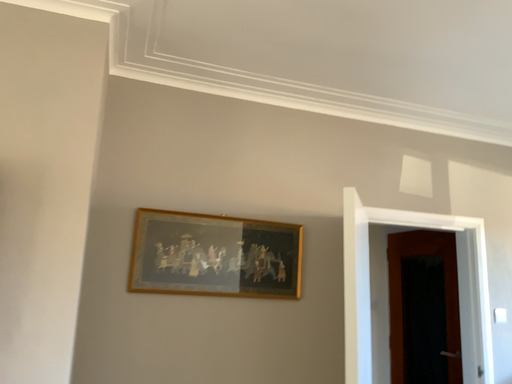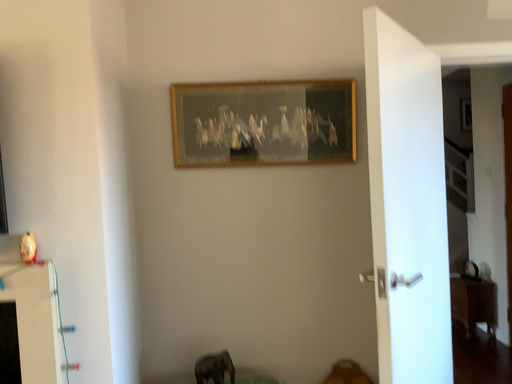
Question: Which way did the camera rotate in the video?

Choices:
 (A) rotated left
 (B) rotated right

Answer: (A)